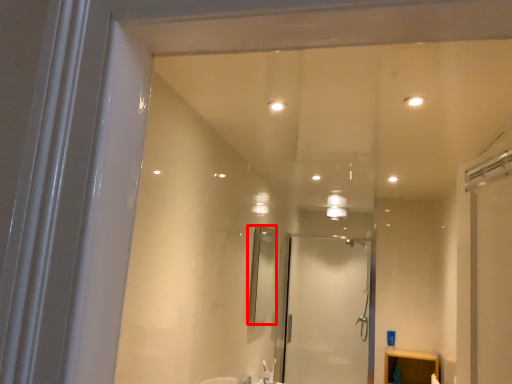
Question: From the image, what is the correct spatial relationship of mirror (annotated by the red box) in relation to screen door?

Choices:
 (A) right
 (B) left

Answer: (B)